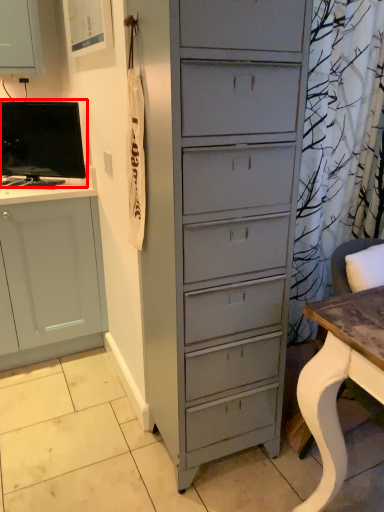
Question: Considering the relative positions of computer monitor (annotated by the red box) and desk in the image provided, where is computer monitor (annotated by the red box) located with respect to the staircase?

Choices:
 (A) right
 (B) left

Answer: (B)